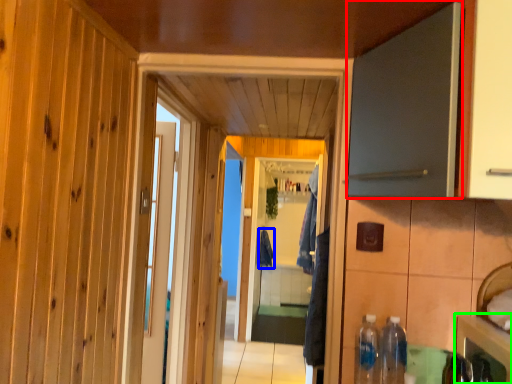
Question: Based on their relative distances, which object is farther from door (highlighted by a red box)? Choose from laundry (highlighted by a blue box) and cabinetry (highlighted by a green box).

Choices:
 (A) laundry
 (B) cabinetry

Answer: (A)